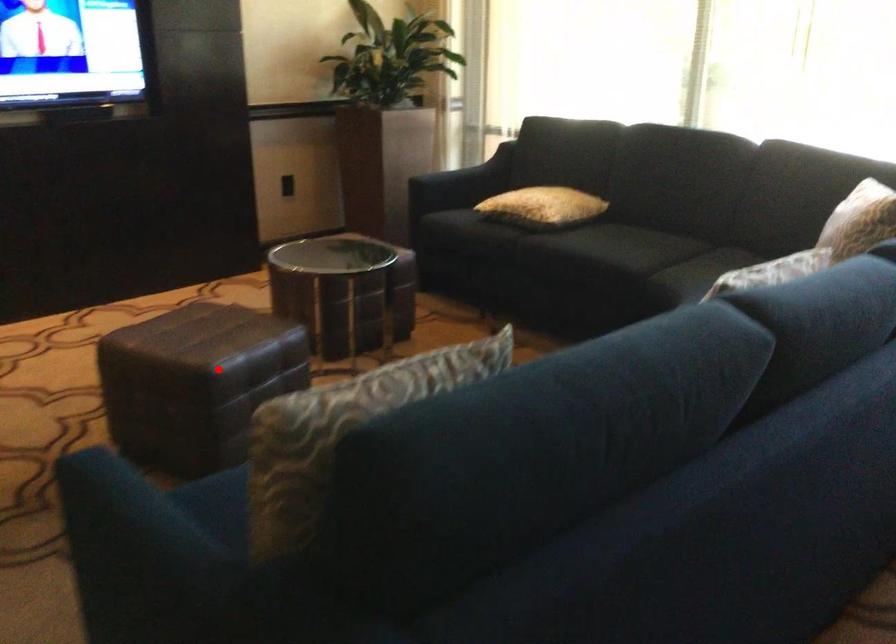
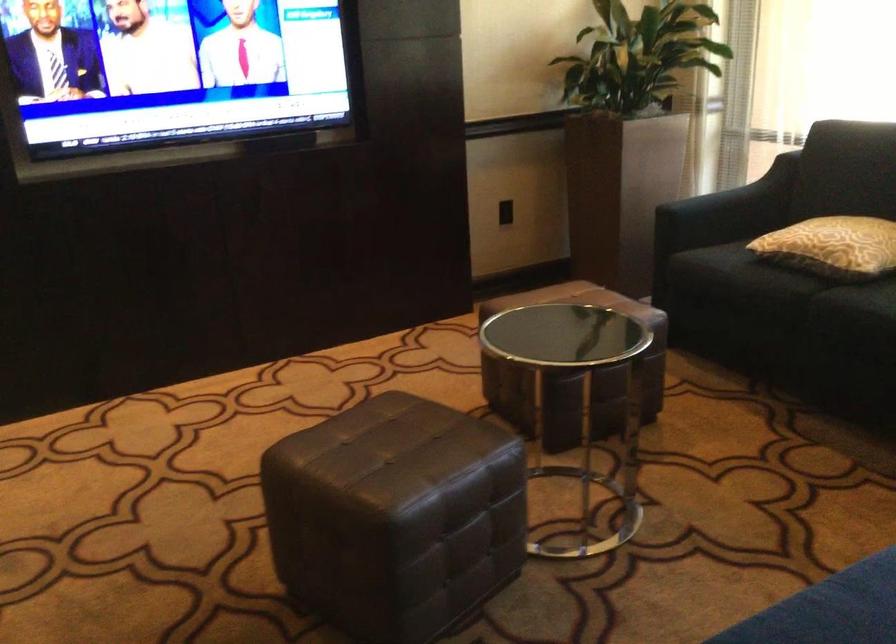
Where in the second image is the point corresponding to the highlighted location from the first image?

(394, 516)